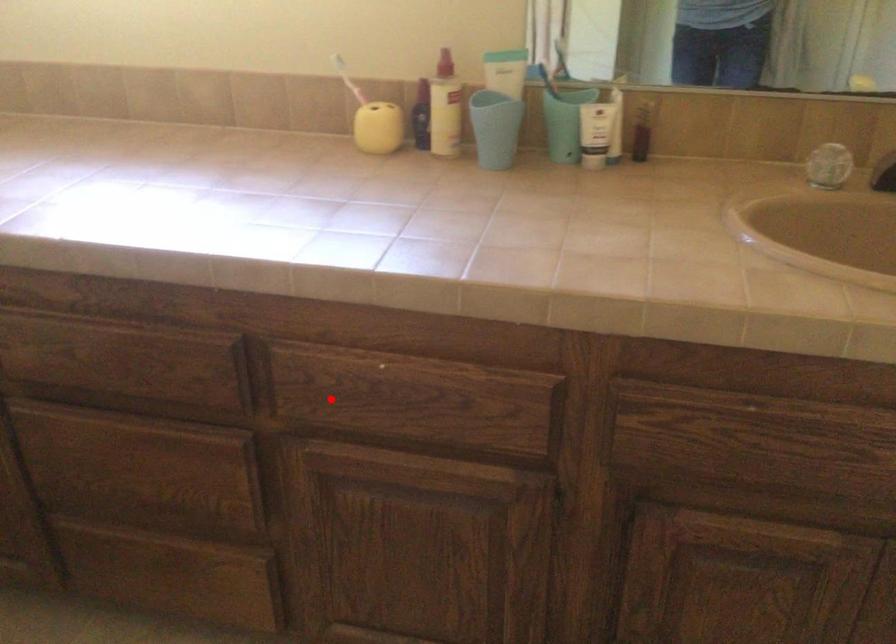
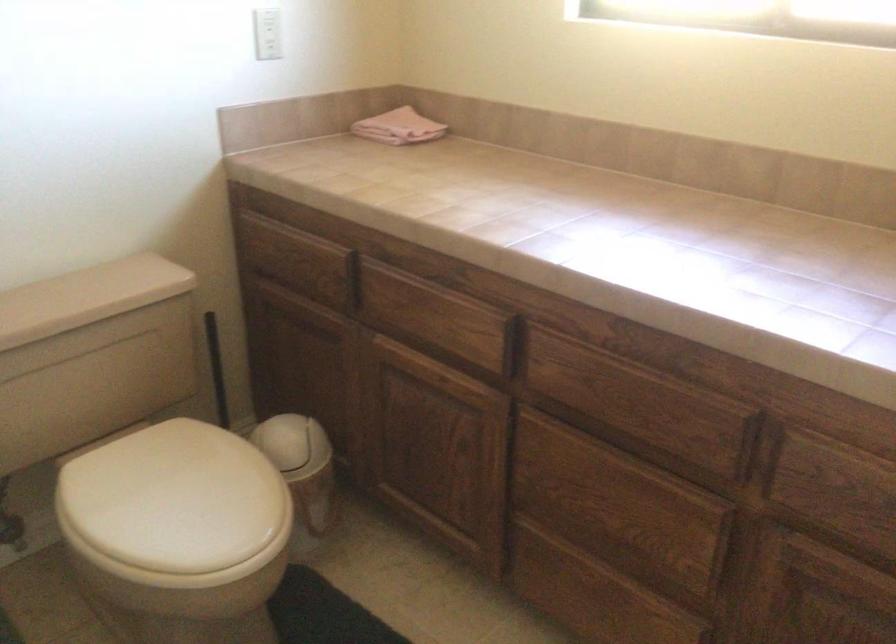
Locate, in the second image, the point that corresponds to the highlighted location in the first image.

(837, 493)